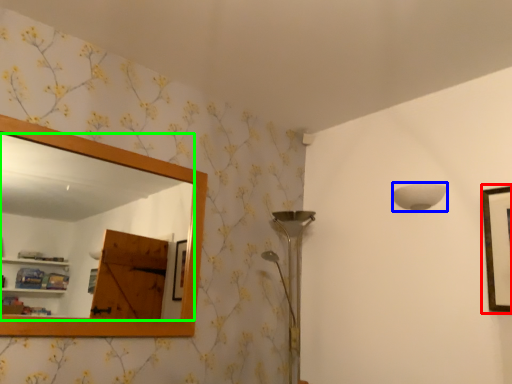
Question: Considering the real-world distances, which object is closest to picture frame (highlighted by a red box)? lamp (highlighted by a blue box) or mirror (highlighted by a green box).

Choices:
 (A) lamp
 (B) mirror

Answer: (A)